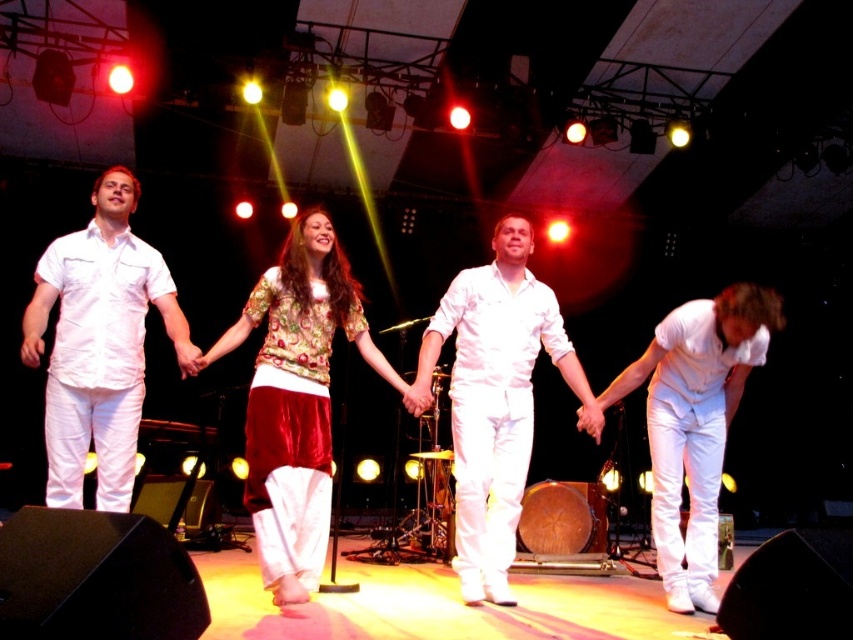
Between velvet floral top at center and white satin pants at lower right, which one appears on the right side from the viewer's perspective?

white satin pants at lower right is more to the right.

The image size is (853, 640). I want to click on velvet floral top at center, so click(x=296, y=400).

Where is `velvet floral top at center`? The height and width of the screenshot is (640, 853). velvet floral top at center is located at coordinates (296, 400).

Can you confirm if white satin pants at left is taller than white satin jumpsuit at center?

No, white satin pants at left is not taller than white satin jumpsuit at center.

Measure the distance between point (120,204) and camera.

Point (120,204) is 12.63 feet away from camera.

Is point (65, 445) farther from camera compared to point (424, 348)?

No, (65, 445) is in front of (424, 348).

The width and height of the screenshot is (853, 640). Find the location of `white satin pants at left`. white satin pants at left is located at coordinates (99, 342).

Between velvet floral top at center and white satin jumpsuit at center, which one has more height?

white satin jumpsuit at center

Consider the image. Does velvet floral top at center have a lesser height compared to white satin jumpsuit at center?

Yes, velvet floral top at center is shorter than white satin jumpsuit at center.

Identify the location of velvet floral top at center. (296, 400).

Locate an element on the screen. velvet floral top at center is located at coordinates (296, 400).